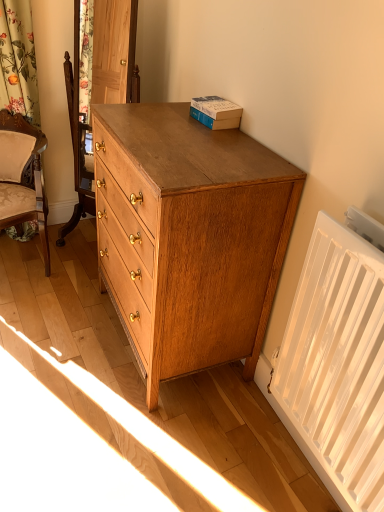
This screenshot has height=512, width=384. I want to click on unoccupied area in front of matte oak chest of drawers at right, so click(144, 437).